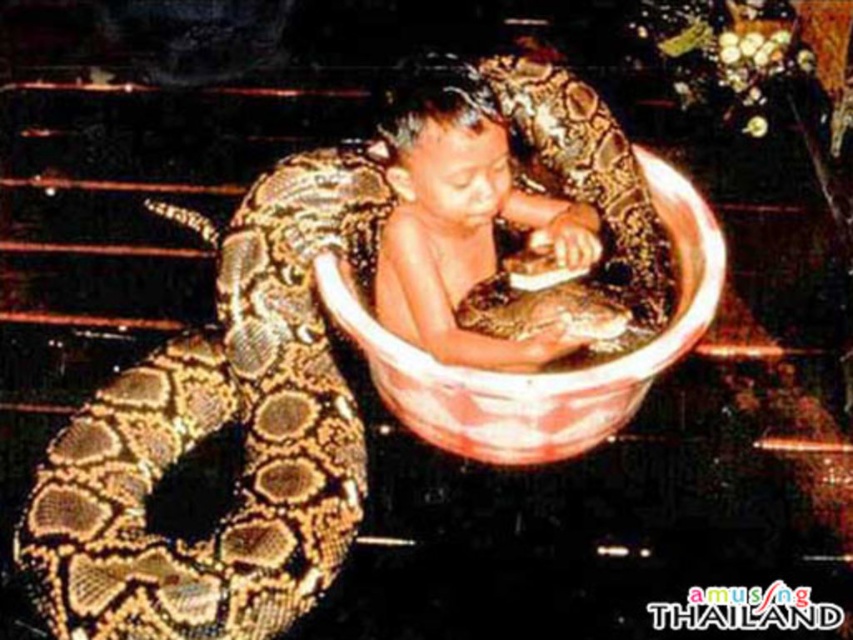
You are a safety inspector evaluating this scene. The smooth skin child at center must be visible to the audience seated in the front row. Given that the matte ceramic bowl at center is placed on a stage, will the child be visible to the front row audience?

The smooth skin child at center has a lesser height compared to matte ceramic bowl at center, so the child will be visible to the front row audience as they are shorter than the bowl.

You are a stagehand in a magic show. You need to quickly retrieve the smooth skin child at center from the brown scaly snake at center. Which object should you move first to reach the child?

You should move the brown scaly snake at center first because it is closer to the viewer than the smooth skin child at center, so the snake is in front of the child and blocking access.

You are a safety inspector evaluating the scene. The safety guidelines state that the snake must be at least 10 feet away from the audience. Is the brown scaly snake at center compliant with this requirement?

The brown scaly snake at center is only 7.97 feet away from the viewer, which is less than the required 10 feet. Therefore, it does not comply with the safety guidelines.